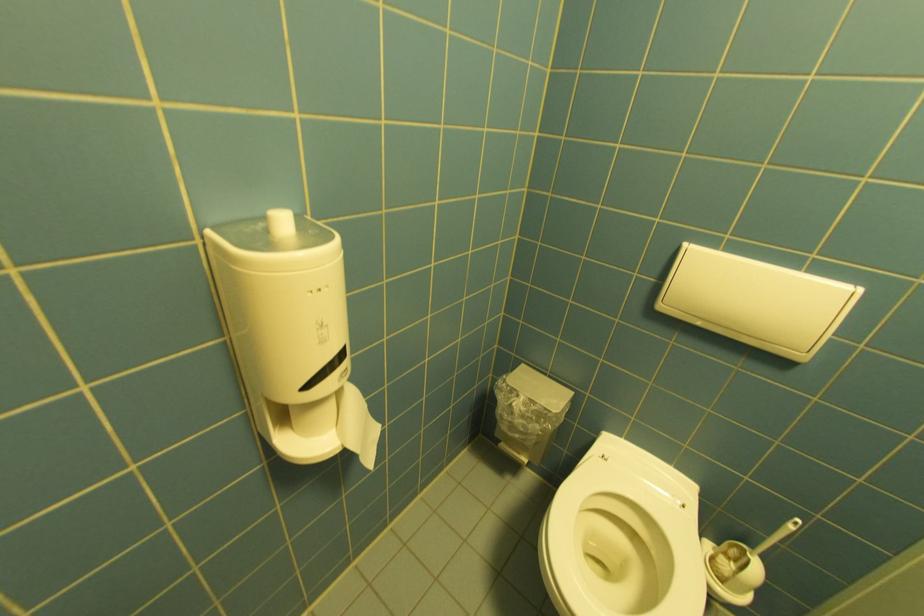
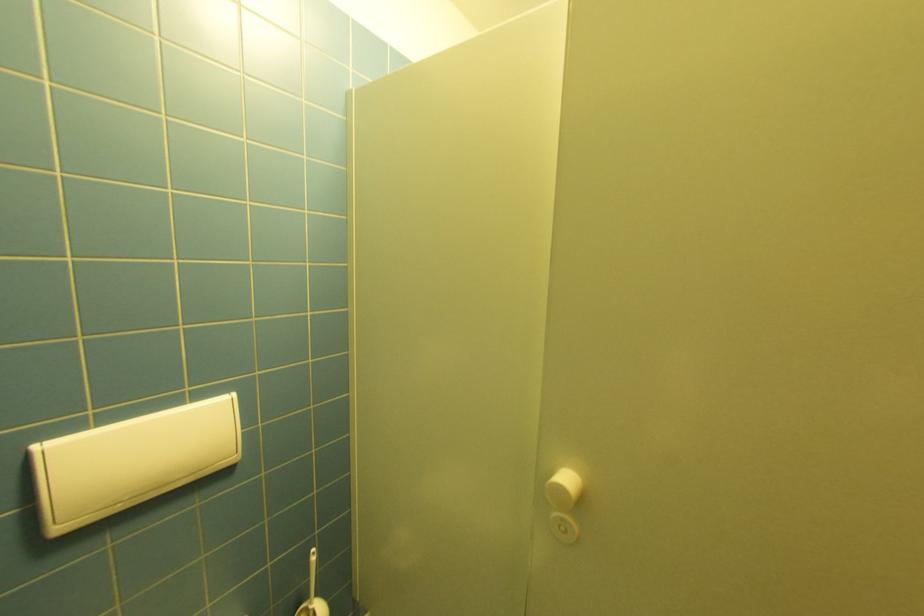
Where in the second image is the point corresponding to (x=666, y=308) from the first image?

(66, 530)